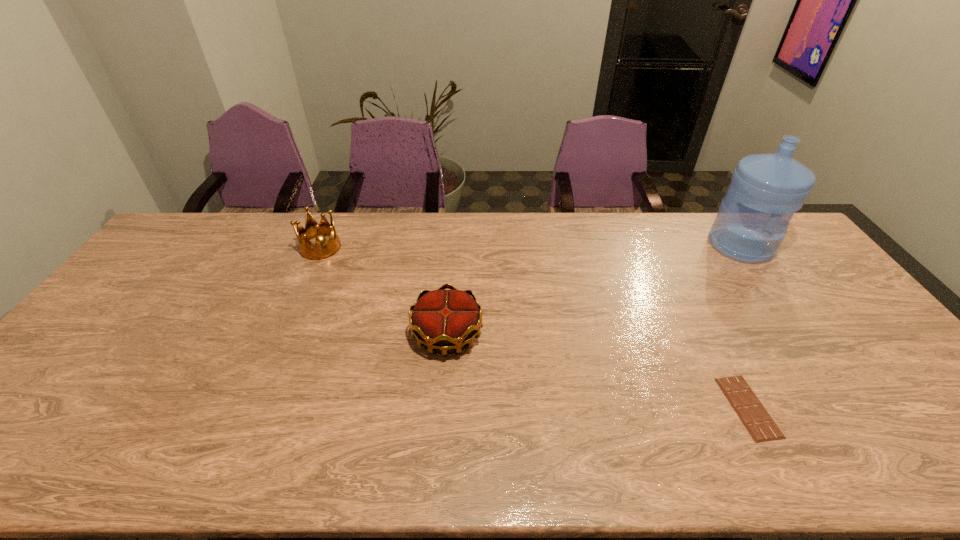
I want to click on vacant area situated 0.120m on the back of the second shortest object, so click(451, 281).

You are a GUI agent. You are given a task and a screenshot of the screen. Output one action in this format:
    pyautogui.click(x=<x>, y=<y>)
    Task: Click on the blank area located 0.070m on the left of the shortest object
    This screenshot has height=540, width=960.
    Given the screenshot: What is the action you would take?
    pyautogui.click(x=698, y=407)

You are a GUI agent. You are given a task and a screenshot of the screen. Output one action in this format:
    pyautogui.click(x=<x>, y=<y>)
    Task: Click on the water jug that is at the far edge
    The image size is (960, 540).
    Given the screenshot: What is the action you would take?
    pyautogui.click(x=765, y=191)

You are a GUI agent. You are given a task and a screenshot of the screen. Output one action in this format:
    pyautogui.click(x=<x>, y=<y>)
    Task: Click on the crown at the far edge
    This screenshot has width=960, height=540.
    Given the screenshot: What is the action you would take?
    pyautogui.click(x=323, y=249)

At what (x,y) coordinates should I click in order to perform the action: click on object present at the near edge. Please return your answer as a coordinate pair (x, y). Looking at the image, I should click on (754, 416).

I want to click on object that is at the right edge, so click(x=765, y=191).

Where is `object situated at the far right corner`? The image size is (960, 540). object situated at the far right corner is located at coordinates (765, 191).

In the image, there is a desktop. Where is `blank space at the far edge`? The height and width of the screenshot is (540, 960). blank space at the far edge is located at coordinates (645, 249).

I want to click on vacant space at the near edge, so click(259, 449).

In order to click on vacant space at the left edge in this screenshot , I will do `click(88, 384)`.